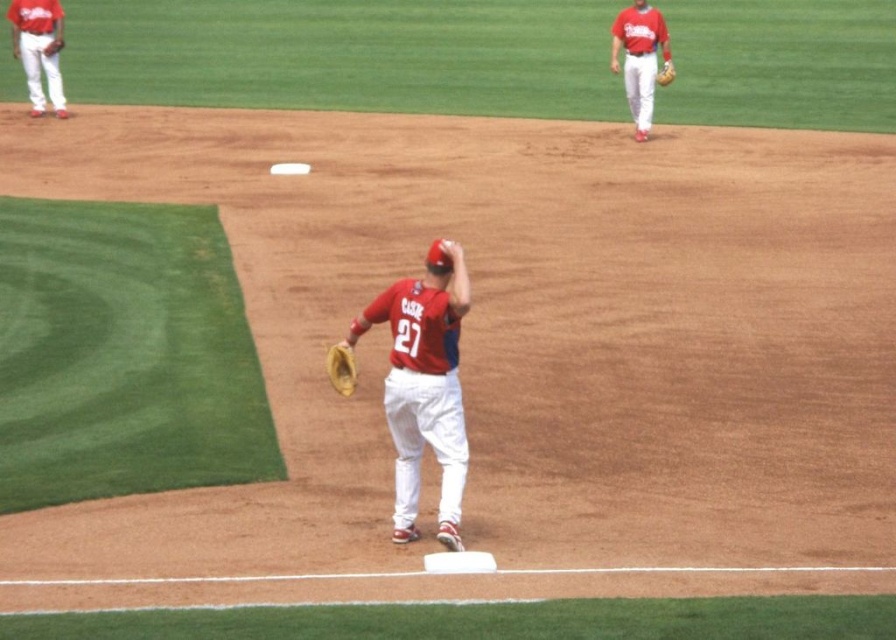
Is brown leather glove at center in front of brown leather glove at upper right?

Yes, brown leather glove at center is closer to the viewer.

Can you confirm if brown leather glove at center is thinner than brown leather glove at upper right?

Indeed, brown leather glove at center has a lesser width compared to brown leather glove at upper right.

Between point (334, 376) and point (666, 74), which one is positioned behind?

The point (666, 74) is more distant.

Locate an element on the screen. brown leather glove at center is located at coordinates (341, 369).

Is matte red baseball glove at center taller than white matte pants at upper left?

Correct, matte red baseball glove at center is much taller as white matte pants at upper left.

Is point (438, 259) farther from viewer compared to point (62, 35)?

No, it is in front of (62, 35).

Image resolution: width=896 pixels, height=640 pixels. In order to click on matte red baseball glove at center in this screenshot , I will do `click(424, 385)`.

Who is taller, white matte pants at upper left or brown leather glove at upper right?

white matte pants at upper left is taller.

Is white matte pants at upper left taller than brown leather glove at upper right?

Yes.

Is point (22, 64) more distant than point (672, 67)?

Yes, point (22, 64) is farther from viewer.

I want to click on white matte pants at upper left, so click(39, 49).